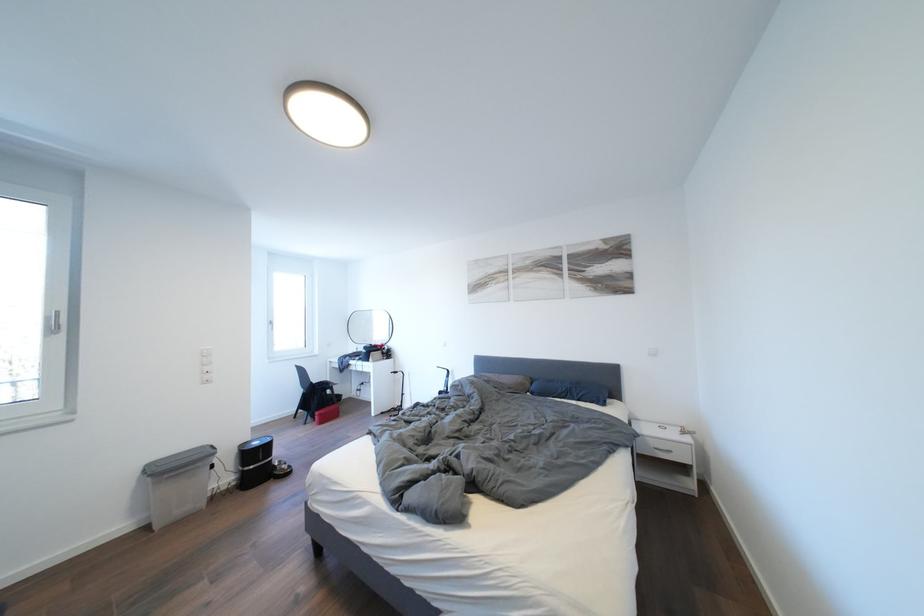
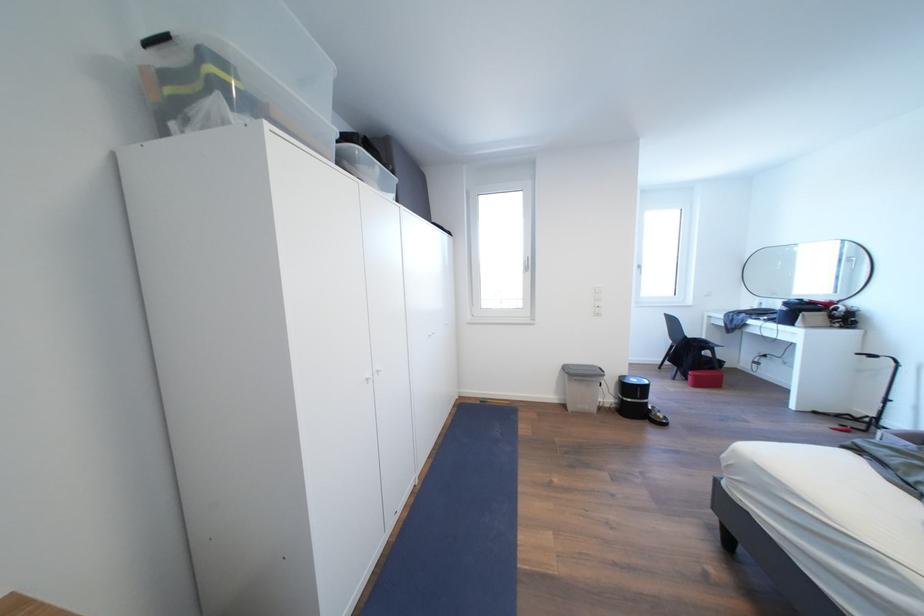
Where in the second image is the point corresponding to [263,448] from the first image?

(641, 386)